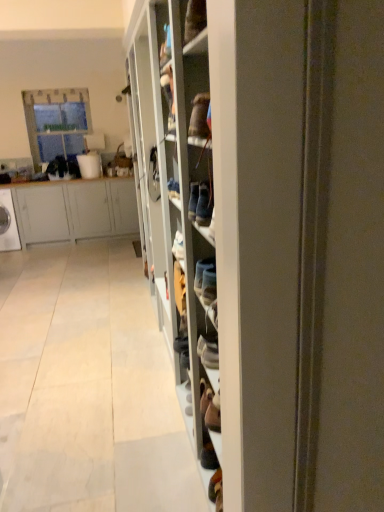
This screenshot has height=512, width=384. Find the location of `white glossy washing machine at left`. white glossy washing machine at left is located at coordinates (8, 223).

This screenshot has width=384, height=512. Find the location of `clear glass window at upper left`. clear glass window at upper left is located at coordinates (56, 122).

Identify the location of matte gray cabinet at left. (75, 210).

You are a GUI agent. You are given a task and a screenshot of the screen. Output one action in this format:
    pyautogui.click(x=<x>, y=<y>)
    Task: Click on the white glossy washing machine at left
    
    Given the screenshot: What is the action you would take?
    pyautogui.click(x=8, y=223)

Is point (7, 246) in front of point (168, 307)?

No.

Find the location of `shelf below the white glossy washing machine at left (from the image's perspective)`. shelf below the white glossy washing machine at left (from the image's perspective) is located at coordinates (268, 239).

In the scene shown: From a real-world perspective, is white glossy washing machine at left beneath wooden shoe rack at center?

Yes, from a real-world perspective, white glossy washing machine at left is under wooden shoe rack at center.

Would you consider white glossy washing machine at left to be distant from wooden shoe rack at center?

white glossy washing machine at left is far away from wooden shoe rack at center.

Does white glossy washing machine at left have a greater height compared to clear glass window at upper left?

Incorrect, the height of white glossy washing machine at left is not larger of that of clear glass window at upper left.

How much distance is there between white glossy washing machine at left and clear glass window at upper left?

white glossy washing machine at left and clear glass window at upper left are 1.14 meters apart.

Is point (3, 242) closer or farther from the camera than point (55, 152)?

Point (3, 242) is positioned closer to the camera compared to point (55, 152).

Where is `washing machine in front of the clear glass window at upper left`? The height and width of the screenshot is (512, 384). washing machine in front of the clear glass window at upper left is located at coordinates (8, 223).

Is matte gray cabinet at left aimed at white glossy washing machine at left?

Yes, matte gray cabinet at left is turned towards white glossy washing machine at left.

Is point (40, 217) closer or farther from the camera than point (1, 218)?

Clearly, point (40, 217) is more distant from the camera than point (1, 218).

Can you confirm if matte gray cabinet at left is taller than white glossy washing machine at left?

Yes.

Is matte gray cabinet at left far from white glossy washing machine at left?

No, matte gray cabinet at left is in close proximity to white glossy washing machine at left.

Which object is positioned more to the left, wooden shoe rack at center or white glossy washing machine at left?

Positioned to the left is white glossy washing machine at left.

Find the location of a particular element. Image resolution: width=384 pixels, height=512 pixels. shelf that appears in front of the white glossy washing machine at left is located at coordinates (268, 239).

Considering the relative sizes of wooden shoe rack at center and white glossy washing machine at left in the image provided, is wooden shoe rack at center thinner than white glossy washing machine at left?

Yes, wooden shoe rack at center is thinner than white glossy washing machine at left.

Which object is further away from the camera, matte gray cabinet at left or wooden shoe rack at center?

matte gray cabinet at left is further from the camera.

Does matte gray cabinet at left have a smaller size compared to wooden shoe rack at center?

Yes.

How different are the orientations of matte gray cabinet at left and wooden shoe rack at center in degrees?

They differ by 89.2 degrees in their facing directions.

Which is in front, point (5, 195) or point (121, 188)?

The point (5, 195) is closer to the camera.

Considering the sizes of objects white glossy washing machine at left and matte gray cabinet at left in the image provided, who is shorter, white glossy washing machine at left or matte gray cabinet at left?

Standing shorter between the two is white glossy washing machine at left.

Is the surface of white glossy washing machine at left in direct contact with matte gray cabinet at left?

No, white glossy washing machine at left is not making contact with matte gray cabinet at left.

From the image's perspective, between white glossy washing machine at left and matte gray cabinet at left, who is located below?

white glossy washing machine at left is shown below in the image.

Considering the relative positions of clear glass window at upper left and matte gray cabinet at left in the image provided, is clear glass window at upper left behind matte gray cabinet at left?

Yes, clear glass window at upper left is behind matte gray cabinet at left.

Is clear glass window at upper left oriented towards matte gray cabinet at left?

No.

Is clear glass window at upper left placed right next to matte gray cabinet at left?

No, clear glass window at upper left is not in contact with matte gray cabinet at left.

Considering the sizes of objects clear glass window at upper left and matte gray cabinet at left in the image provided, who is smaller, clear glass window at upper left or matte gray cabinet at left?

Smaller between the two is clear glass window at upper left.

Identify the location of shelf above the white glossy washing machine at left (from a real-world perspective). The image size is (384, 512). (268, 239).

Identify the location of washing machine below the clear glass window at upper left (from the image's perspective). (8, 223).

Which object lies further to the anchor point wooden shoe rack at center, clear glass window at upper left or white glossy washing machine at left?

The object further to wooden shoe rack at center is white glossy washing machine at left.

Estimate the real-world distances between objects in this image. Which object is further from matte gray cabinet at left, wooden shoe rack at center or clear glass window at upper left?

Among the two, wooden shoe rack at center is located further to matte gray cabinet at left.

Estimate the real-world distances between objects in this image. Which object is further from white glossy washing machine at left, clear glass window at upper left or wooden shoe rack at center?

wooden shoe rack at center is positioned further to the anchor white glossy washing machine at left.

When comparing their distances from white glossy washing machine at left, does wooden shoe rack at center or clear glass window at upper left seem closer?

Based on the image, clear glass window at upper left appears to be nearer to white glossy washing machine at left.

Looking at the image, which one is located closer to wooden shoe rack at center, white glossy washing machine at left or matte gray cabinet at left?

matte gray cabinet at left.

Based on their spatial positions, is clear glass window at upper left or white glossy washing machine at left closer to matte gray cabinet at left?

white glossy washing machine at left is closer to matte gray cabinet at left.

From the image, which object appears to be farther from white glossy washing machine at left, matte gray cabinet at left or clear glass window at upper left?

clear glass window at upper left is positioned further to the anchor white glossy washing machine at left.

From the picture: From the image, which object appears to be farther from white glossy washing machine at left, clear glass window at upper left or matte gray cabinet at left?

clear glass window at upper left is further to white glossy washing machine at left.

Identify the location of cabinetry between wooden shoe rack at center and white glossy washing machine at left from front to back. Image resolution: width=384 pixels, height=512 pixels. (75, 210).

Identify the location of washing machine between wooden shoe rack at center and clear glass window at upper left along the z-axis. (8, 223).

Identify the location of cabinetry between clear glass window at upper left and white glossy washing machine at left from top to bottom. The image size is (384, 512). (75, 210).

The height and width of the screenshot is (512, 384). Find the location of `cabinetry located between wooden shoe rack at center and clear glass window at upper left in the depth direction`. cabinetry located between wooden shoe rack at center and clear glass window at upper left in the depth direction is located at coordinates (75, 210).